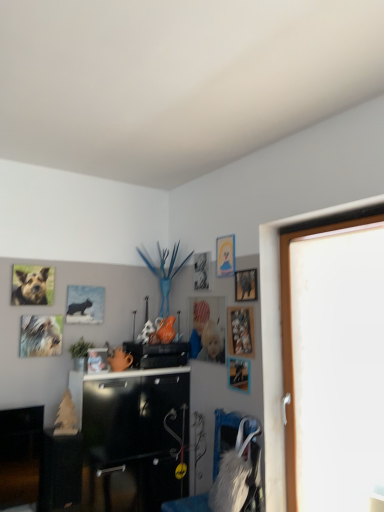
The width and height of the screenshot is (384, 512). What are the coordinates of `vacant space situated above white wooden door at right (from a real-world perspective)` in the screenshot? It's located at (309, 222).